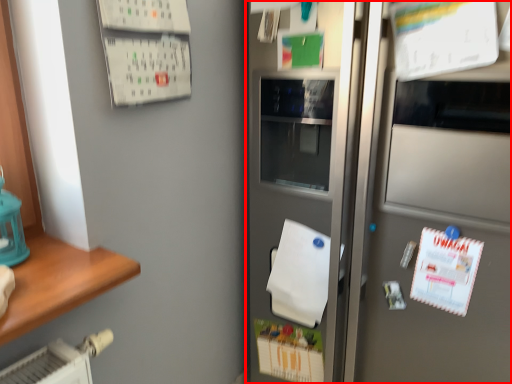
Question: Considering the relative positions of refrigerator (annotated by the red box) and wrapping paper in the image provided, where is refrigerator (annotated by the red box) located with respect to the staircase?

Choices:
 (A) left
 (B) right

Answer: (B)